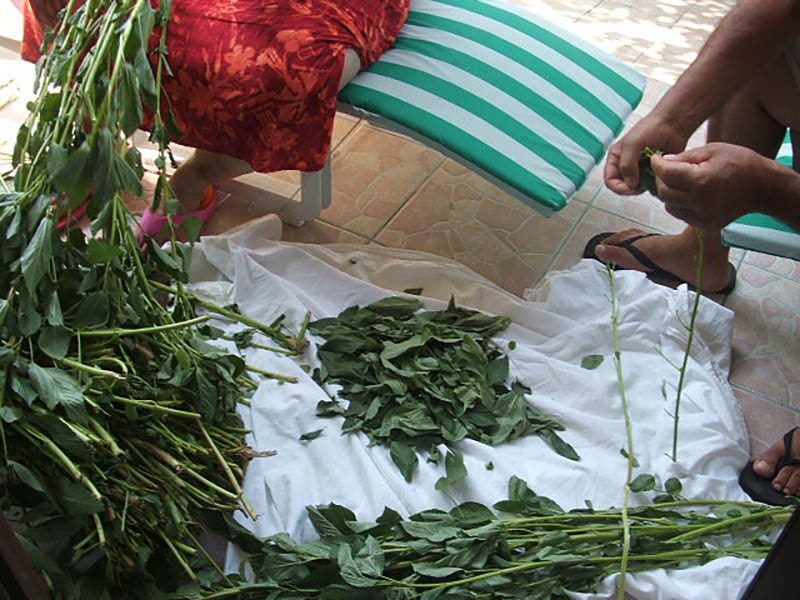
Where is `chair leg`? The height and width of the screenshot is (600, 800). chair leg is located at coordinates (298, 210).